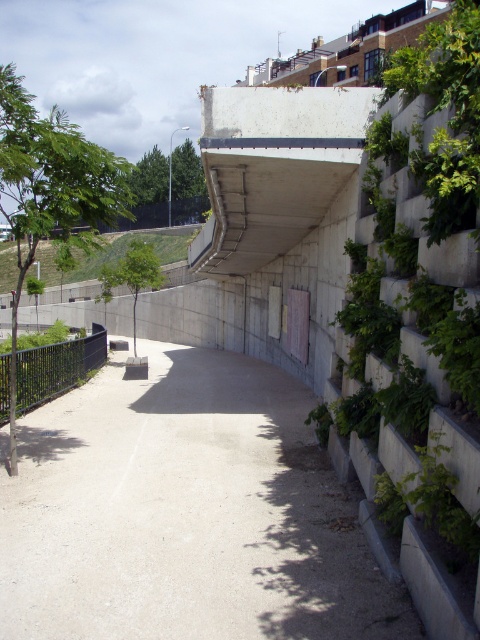
Between point (268, 202) and point (122, 177), which one is positioned behind?

The point (268, 202) is behind.

Does point (216, 108) lie in front of point (7, 116)?

No, it is not.

Where is `white concrete overpass at upper center`? white concrete overpass at upper center is located at coordinates [273, 168].

Which is more to the left, green leafy tree at left or green leafy tree at center?

green leafy tree at left

Can you confirm if green leafy tree at left is taller than green leafy tree at center?

Correct, green leafy tree at left is much taller as green leafy tree at center.

Measure the distance between point (x=127, y=193) and camera.

Point (x=127, y=193) and camera are 27.19 feet apart from each other.

The image size is (480, 640). What are the coordinates of `green leafy tree at left` in the screenshot? It's located at (49, 189).

Consider the image. Does gray concrete path at center appear under green leafy tree at left?

Yes, gray concrete path at center is below green leafy tree at left.

Is point (93, 529) farther from camera compared to point (22, 285)?

No, (93, 529) is closer to viewer.

This screenshot has width=480, height=640. What do you see at coordinates (184, 513) in the screenshot? I see `gray concrete path at center` at bounding box center [184, 513].

You are a GUI agent. You are given a task and a screenshot of the screen. Output one action in this format:
    pyautogui.click(x=<x>, y=<y>)
    Task: Click on the gray concrete path at center
    The image size is (480, 640).
    Given the screenshot: What is the action you would take?
    pyautogui.click(x=184, y=513)